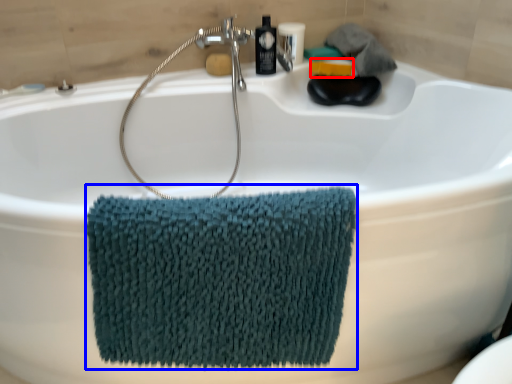
Question: Which object appears farthest to the camera in this image, soap (highlighted by a red box) or bath towel (highlighted by a blue box)?

Choices:
 (A) soap
 (B) bath towel

Answer: (A)